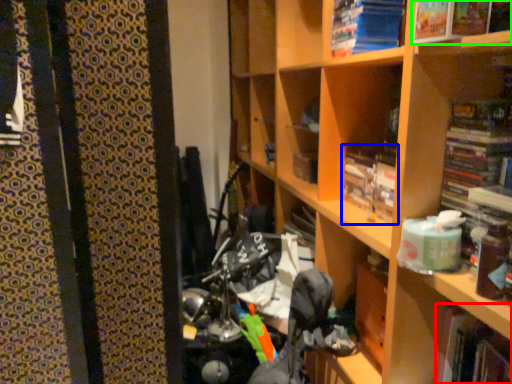
Question: Which is nearer to the book (highlighted by a red box)? book (highlighted by a blue box) or book (highlighted by a green box).

Choices:
 (A) book
 (B) book

Answer: (A)